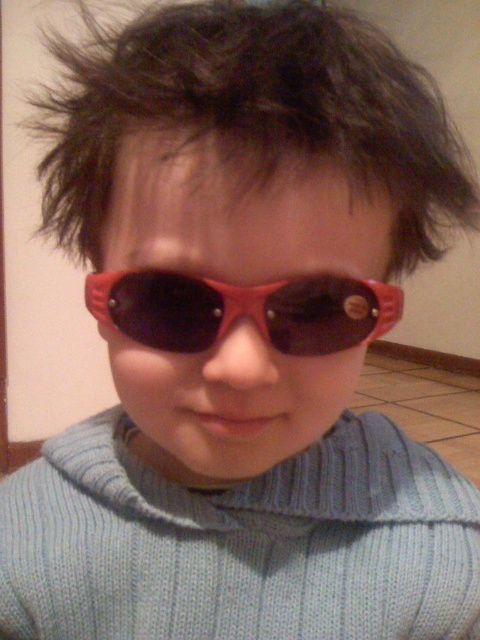
Measure the distance between point [348,67] and camera.

Point [348,67] and camera are 9.92 inches apart from each other.

Is dark brown spiky hair at upper center bigger than rubberized red goggles at center?

Yes, dark brown spiky hair at upper center is bigger than rubberized red goggles at center.

What do you see at coordinates (256, 109) in the screenshot? I see `dark brown spiky hair at upper center` at bounding box center [256, 109].

The height and width of the screenshot is (640, 480). In order to click on dark brown spiky hair at upper center in this screenshot , I will do click(x=256, y=109).